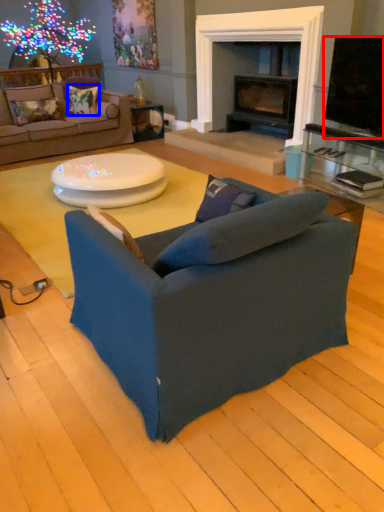
Question: Which object is closer to the camera taking this photo, television (highlighted by a red box) or pillow (highlighted by a blue box)?

Choices:
 (A) television
 (B) pillow

Answer: (A)